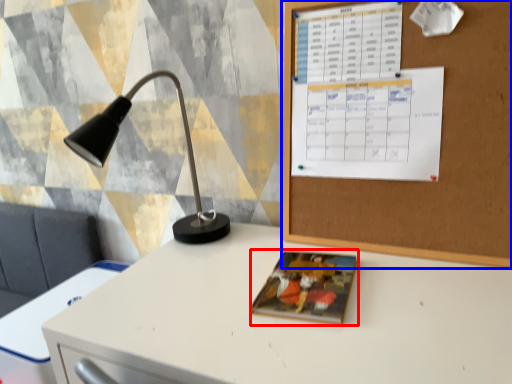
Question: Among these objects, which one is nearest to the camera, book cover (highlighted by a red box) or bulletin board (highlighted by a blue box)?

Choices:
 (A) book cover
 (B) bulletin board

Answer: (B)